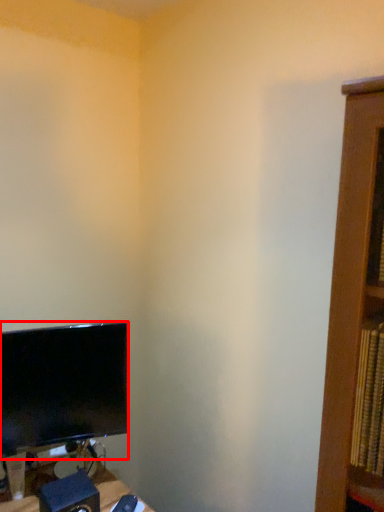
Question: From the image's perspective, considering the relative positions of computer monitor (annotated by the red box) and speaker in the image provided, where is computer monitor (annotated by the red box) located with respect to the staircase?

Choices:
 (A) below
 (B) above

Answer: (B)